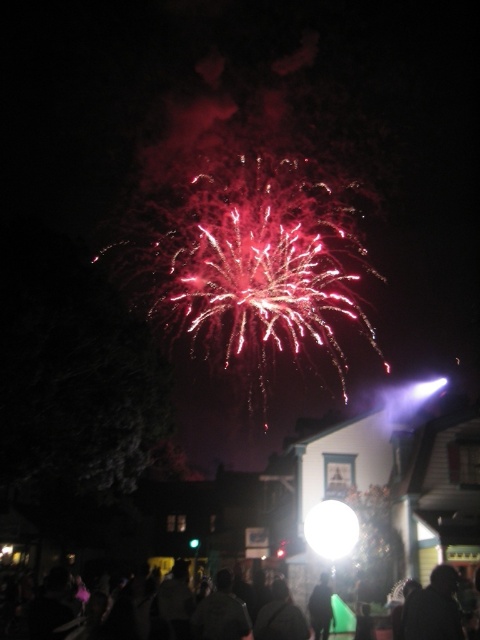
Question: Is black matte person at lower right above bright white sphere at center?

Choices:
 (A) yes
 (B) no

Answer: (A)

Question: Can you confirm if bright white sphere at center is bigger than black matte jacket at lower center?

Choices:
 (A) yes
 (B) no

Answer: (B)

Question: Can you confirm if black matte person at lower right is positioned above black matte jacket at lower center?

Choices:
 (A) no
 (B) yes

Answer: (B)

Question: Which of these objects is positioned closest to the black matte jacket at lower center?

Choices:
 (A) bright white sphere at center
 (B) black matte person at lower right
 (C) black fabric crowd at lower center

Answer: (A)

Question: Estimate the real-world distances between objects in this image. Which object is farther from the black matte person at lower right?

Choices:
 (A) black matte jacket at lower center
 (B) black fabric crowd at lower center
 (C) bright white sphere at center

Answer: (B)

Question: Among these objects, which one is nearest to the camera?

Choices:
 (A) black matte person at lower right
 (B) black matte jacket at lower center
 (C) black fabric crowd at lower center

Answer: (A)